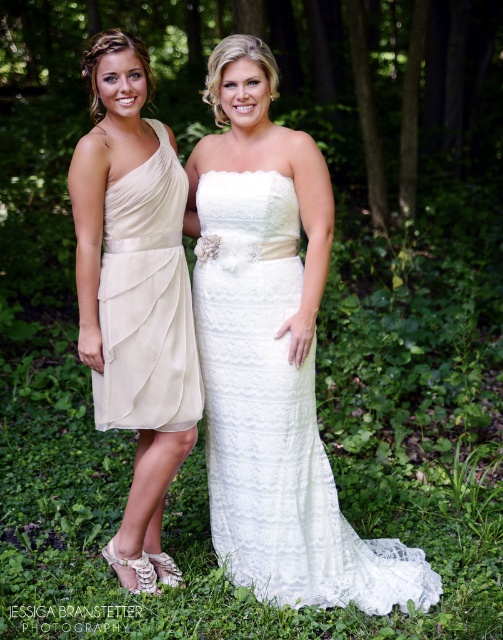
You are standing at the point marked as point (166, 348) in the forest. You want to take a photo of the two women in the image using a camera that has a maximum range of 12 feet. Will you be able to capture them clearly in your photo?

The distance between point (166, 348) and the camera is 10.95 feet, which is within the camera maximum range of 12 feet. Therefore, you can capture them clearly.

You are a photographer setting up for a photoshoot in a forest. You have two dresses displayed in the scene, the ivory lace dress at center and the ivory satin dress at left. Since you want to ensure the dresses are spaced appropriately for the shoot, can you determine which dress requires more space due to its width?

The ivory lace dress at center requires more space because its width is larger than the ivory satin dress at left.